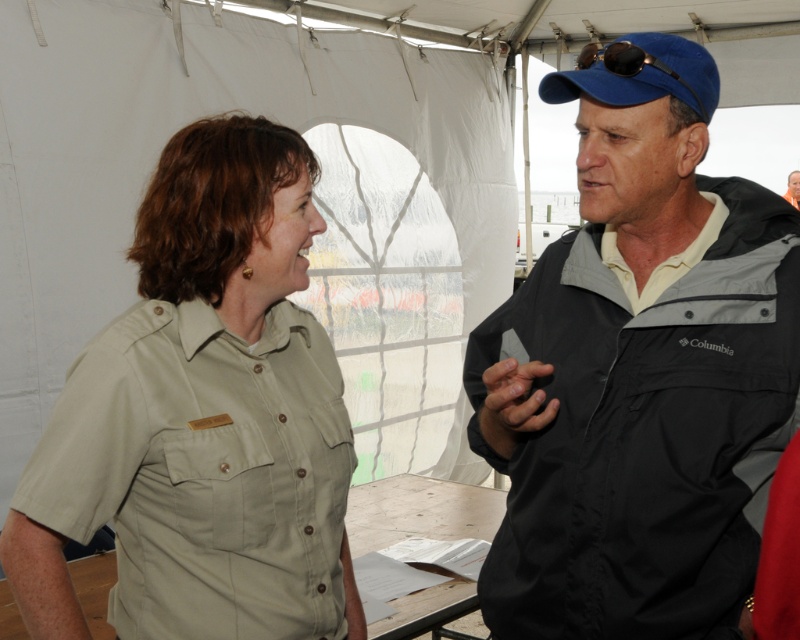
Question: In this image, where is satin khaki shirt at center located relative to matte black jacket at upper right?

Choices:
 (A) right
 (B) left

Answer: (B)

Question: Can you confirm if satin khaki shirt at center is smaller than matte black jacket at upper right?

Choices:
 (A) yes
 (B) no

Answer: (B)

Question: Which object is positioned closest to the black fabric jacket at upper right?

Choices:
 (A) matte black jacket at upper right
 (B) satin khaki shirt at center

Answer: (B)

Question: Which object is farther from the camera taking this photo?

Choices:
 (A) satin khaki shirt at center
 (B) matte black jacket at upper right
 (C) black fabric jacket at upper right

Answer: (B)

Question: Can you confirm if black fabric jacket at upper right is positioned above satin khaki shirt at center?

Choices:
 (A) no
 (B) yes

Answer: (B)

Question: Which is nearer to the satin khaki shirt at center?

Choices:
 (A) matte black jacket at upper right
 (B) black fabric jacket at upper right

Answer: (B)